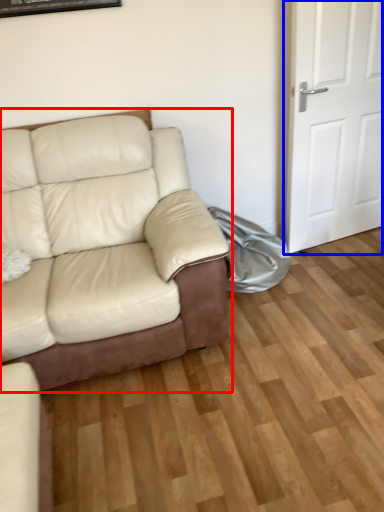
Question: Which point is further to the camera, studio couch (highlighted by a red box) or door (highlighted by a blue box)?

Choices:
 (A) studio couch
 (B) door

Answer: (B)